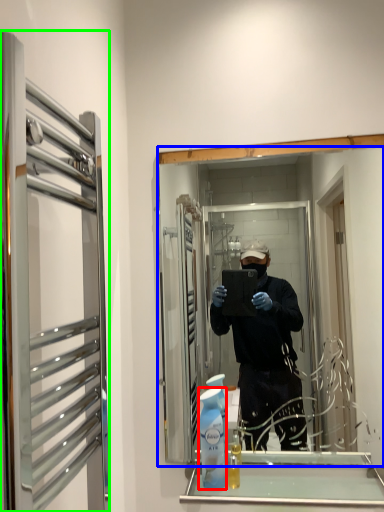
Question: Which object is positioned closest to cleaning product (highlighted by a red box)? Select from mirror (highlighted by a blue box) and glass door (highlighted by a green box).

Choices:
 (A) mirror
 (B) glass door

Answer: (B)